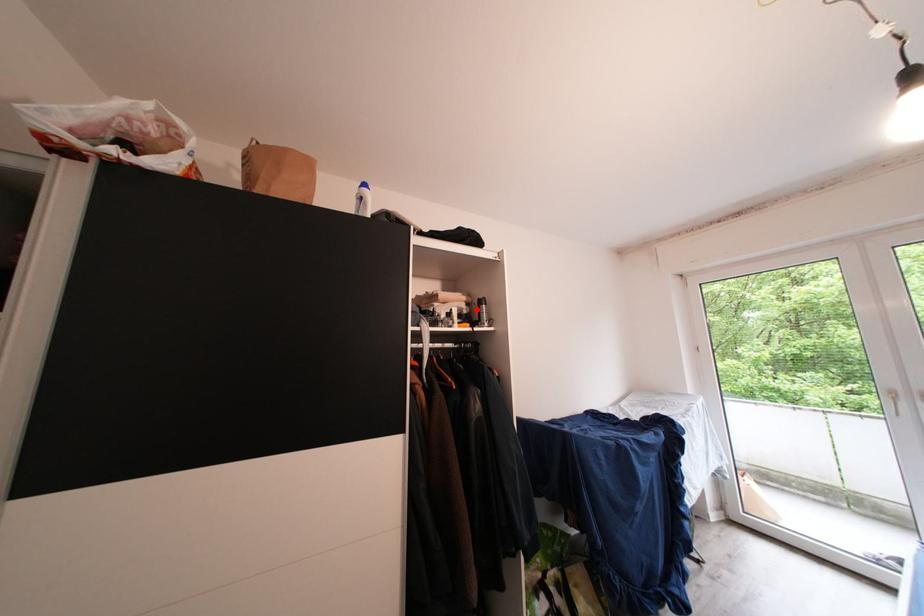
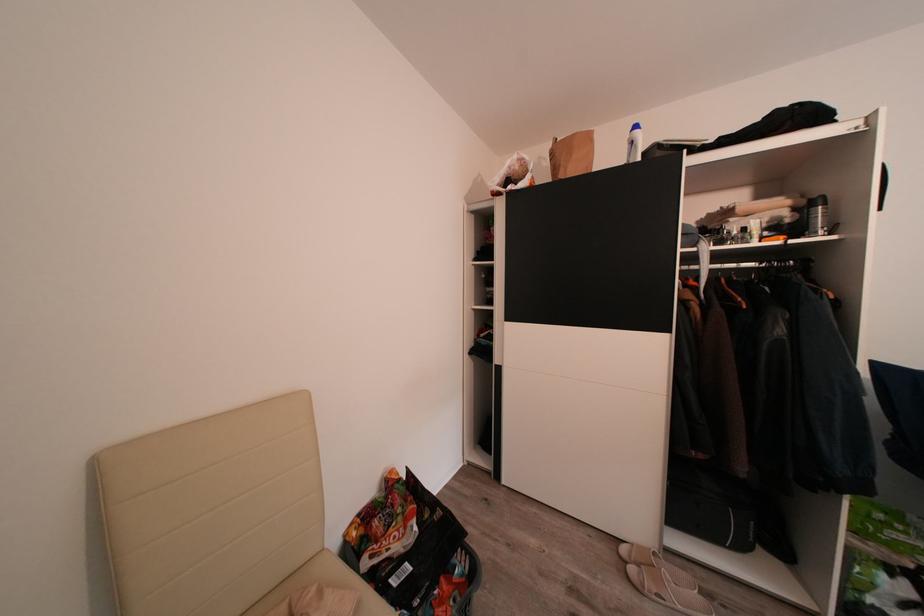
The point at the highlighted location is marked in the first image. Where is the corresponding point in the second image?

(805, 215)